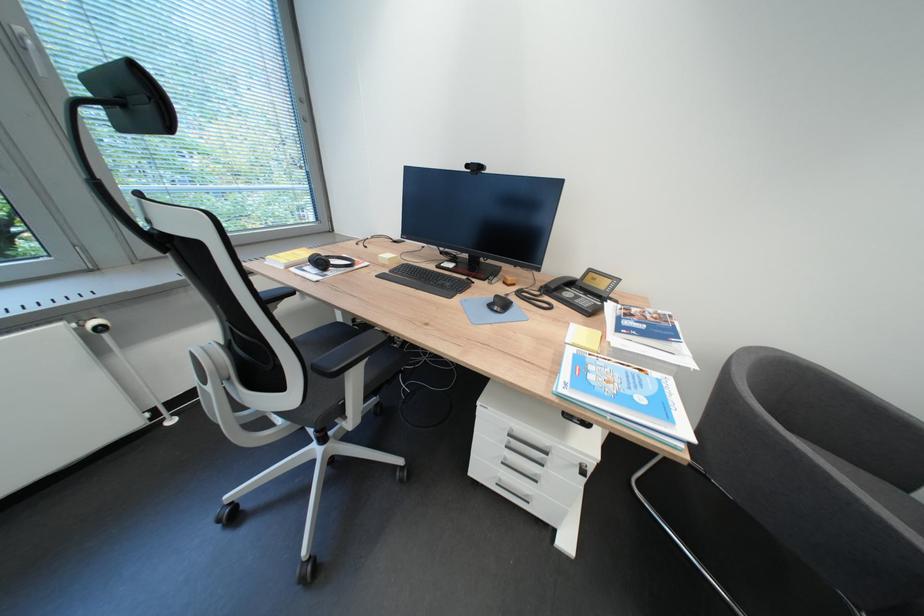
Image resolution: width=924 pixels, height=616 pixels. Find the location of `black computer mouse`. black computer mouse is located at coordinates [x=499, y=304].